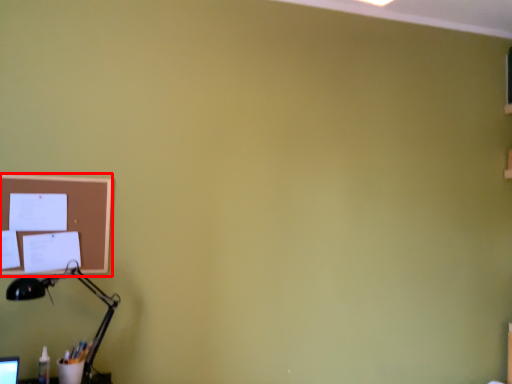
Question: From the image's perspective, what is the correct spatial relationship of bulletin board (annotated by the red box) in relation to lamp?

Choices:
 (A) below
 (B) above

Answer: (B)